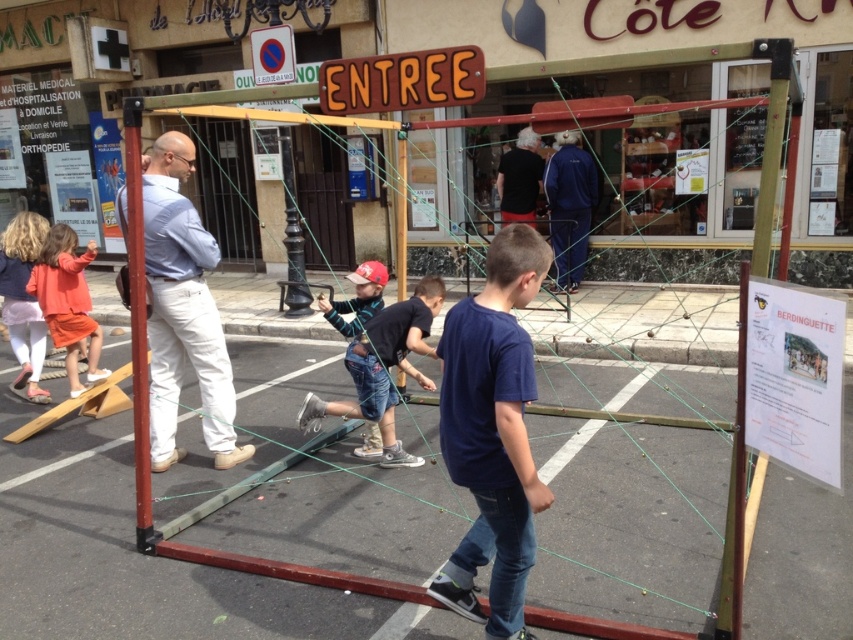
You are a photographer positioned at the entrance of the structure. You want to take a photo that includes both the blue track suit at center and the black cotton shirt at center. Which one will appear larger in the photo?

The blue track suit at center will appear larger in the photo because it is closer to the viewer than the black cotton shirt at center.

You are standing in the urban setting and see the orange cotton dress at left and the black cotton shirt at center. Which clothing item is positioned more to the left side of the scene?

The orange cotton dress at left is positioned more to the left side of the scene than the black cotton shirt at center.